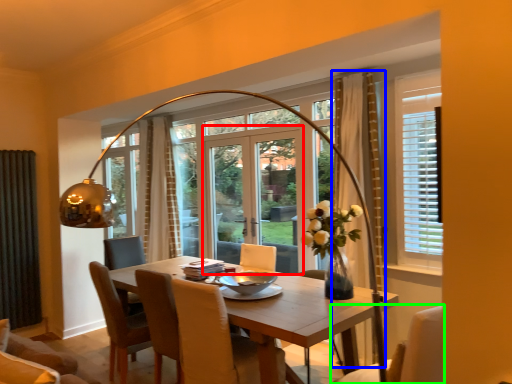
Question: Considering the real-world distances, which object is closest to screen door (highlighted by a red box)? curtain (highlighted by a blue box) or chair (highlighted by a green box).

Choices:
 (A) curtain
 (B) chair

Answer: (A)